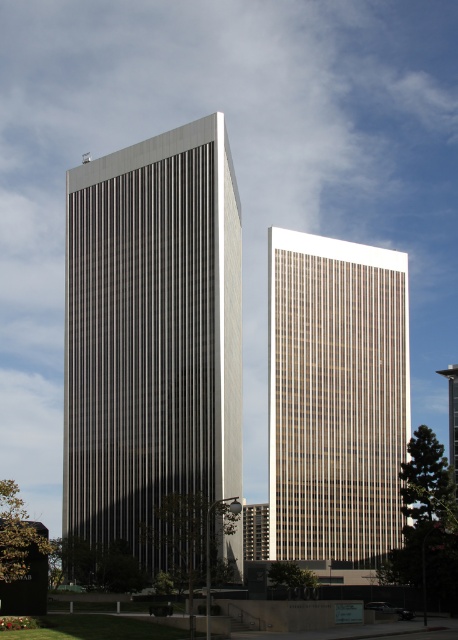
Question: Is the position of white textured building at center more distant than that of beige glass tower at center?

Choices:
 (A) no
 (B) yes

Answer: (A)

Question: Can you confirm if white textured building at center is positioned to the left of beige glass tower at center?

Choices:
 (A) yes
 (B) no

Answer: (A)

Question: Which point is closer to the camera?

Choices:
 (A) beige glass tower at center
 (B) white textured building at center

Answer: (B)

Question: Which object is farther from the camera taking this photo?

Choices:
 (A) beige glass tower at center
 (B) white textured building at center

Answer: (A)

Question: Which object appears closest to the camera in this image?

Choices:
 (A) white textured building at center
 (B) beige glass tower at center

Answer: (A)

Question: Does white textured building at center appear on the right side of beige glass tower at center?

Choices:
 (A) yes
 (B) no

Answer: (B)